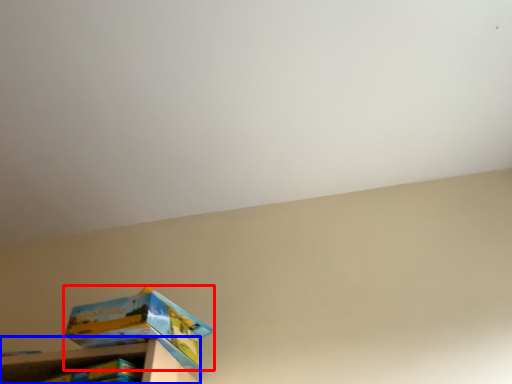
Question: Which of the following is the closest to the observer, box (highlighted by a red box) or shelf (highlighted by a blue box)?

Choices:
 (A) box
 (B) shelf

Answer: (B)